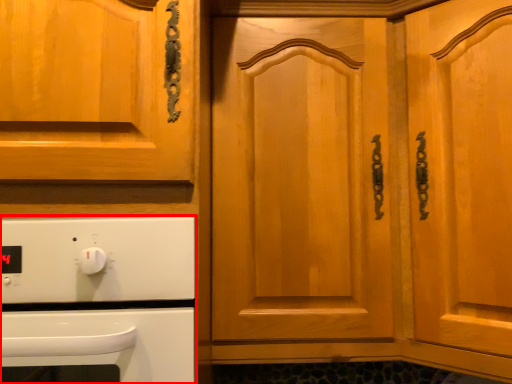
Question: From the image's perspective, considering the relative positions of home appliance (annotated by the red box) and door in the image provided, where is home appliance (annotated by the red box) located with respect to the staircase?

Choices:
 (A) above
 (B) below

Answer: (B)